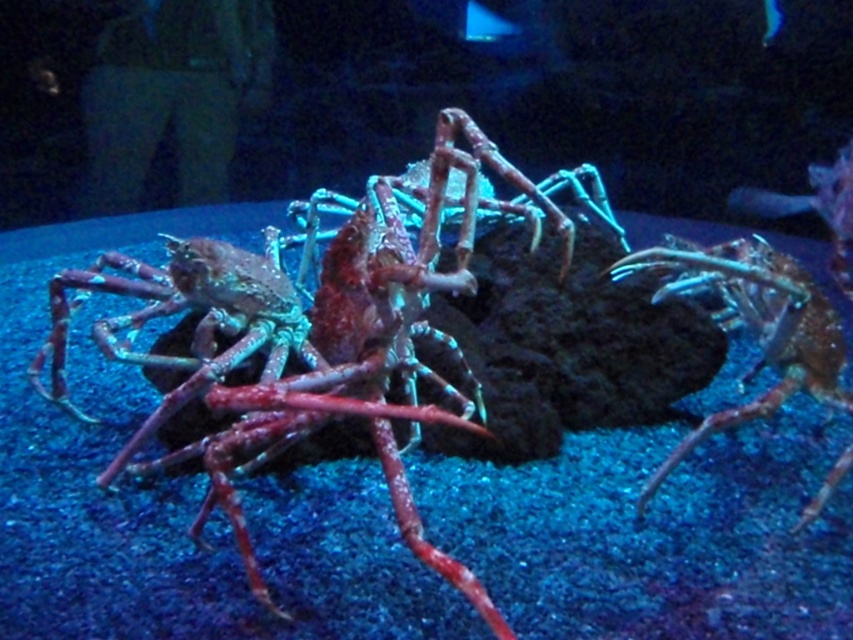
Does shiny red crab at center appear under shiny metallic crab claw at center?

No, shiny red crab at center is not below shiny metallic crab claw at center.

Is shiny red crab at center smaller than shiny metallic crab claw at center?

No, shiny red crab at center is not smaller than shiny metallic crab claw at center.

Who is more forward, [346,378] or [750,294]?

Point [346,378] is in front.

The image size is (853, 640). I want to click on shiny red crab at center, so click(347, 339).